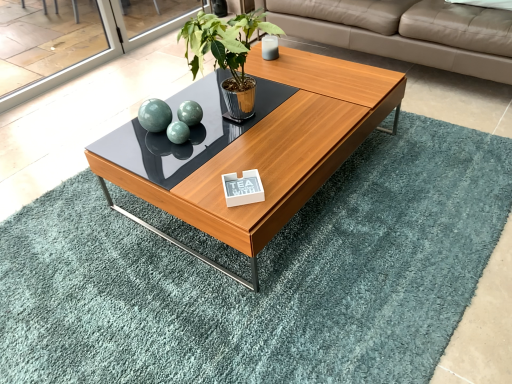
This screenshot has width=512, height=384. In order to click on free space in front of green leafy plant at center in this screenshot , I will do `click(249, 165)`.